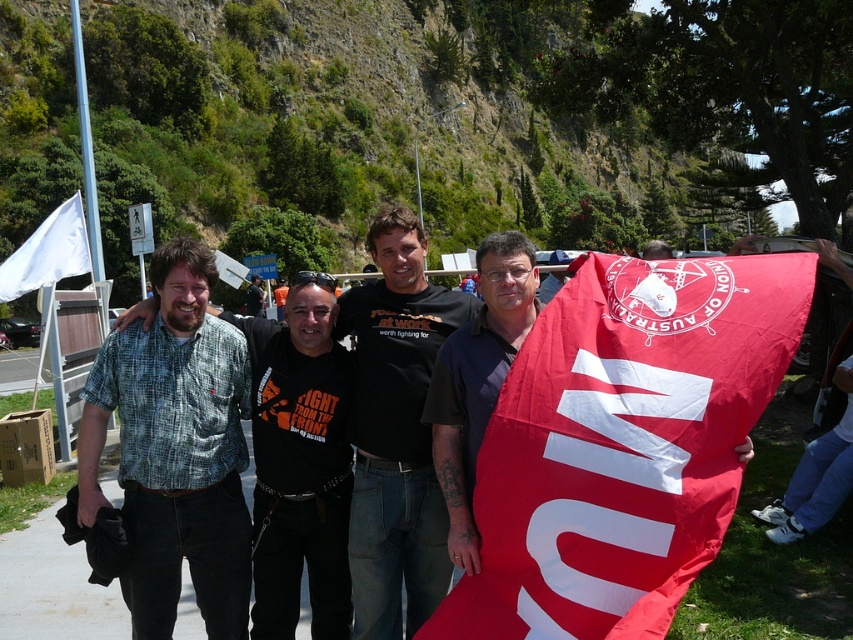
From the picture: You are a photographer trying to capture a clear shot of the dark blue shirt at center and the green plaid shirt at left. Based on their positions, which one is closer to the camera?

The green plaid shirt at left is closer to the camera because the dark blue shirt at center is positioned behind it.

You are a photographer adjusting your camera to focus on two specific points in the scene. The first point is at coordinates point (395,577) and the second is at point (335,292). Which point should you focus on first if you want to capture the closest object in the image?

Point (395,577) is closer to the viewer than point (335,292), so you should focus on point (395,577) first to capture the closest object.